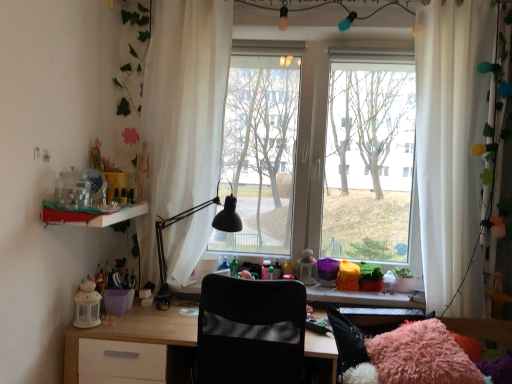
Where is `unoccupied area in front of black matte desk lamp at center`? This screenshot has width=512, height=384. unoccupied area in front of black matte desk lamp at center is located at coordinates (158, 326).